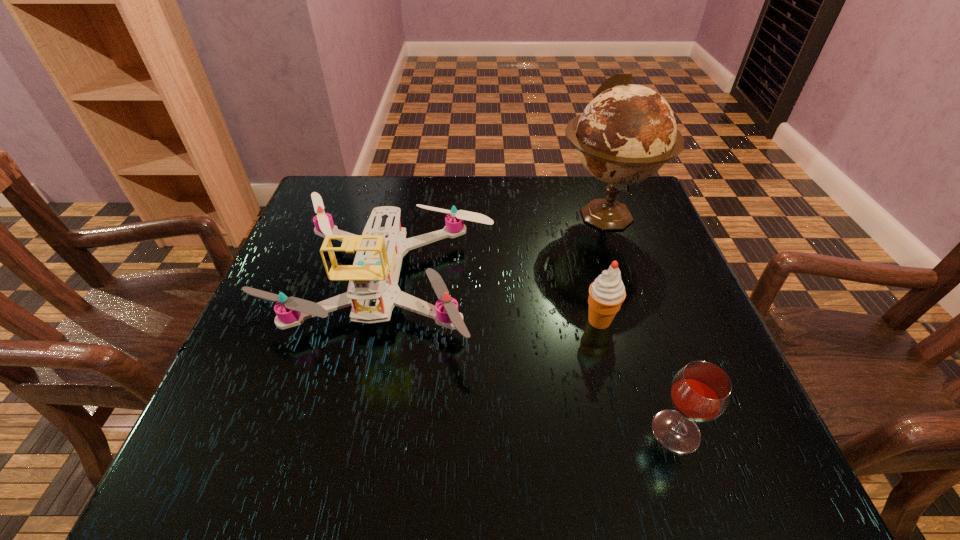
The image size is (960, 540). What are the coordinates of `globe` in the screenshot? It's located at (626, 133).

Find the location of a particular element. Image resolution: width=960 pixels, height=540 pixels. the leftmost object is located at coordinates (373, 291).

Find the location of `drone`. drone is located at coordinates (373, 291).

Find the location of a particular element. This screenshot has width=960, height=540. icecream is located at coordinates (x=606, y=294).

The image size is (960, 540). Identify the location of wineglass. (700, 392).

The height and width of the screenshot is (540, 960). Identify the location of free region located 0.300m on the front of the globe showing Asia. (651, 353).

Image resolution: width=960 pixels, height=540 pixels. In order to click on free point located 0.090m on the front-facing side of the leftmost object in this screenshot , I will do `click(356, 415)`.

Locate an element on the screen. The width and height of the screenshot is (960, 540). vacant space located on the back of the icecream is located at coordinates (588, 274).

The height and width of the screenshot is (540, 960). Identify the location of vacant space located 0.310m on the left of the wineglass. (459, 431).

Image resolution: width=960 pixels, height=540 pixels. Identify the location of globe located in the far edge section of the desktop. (626, 133).